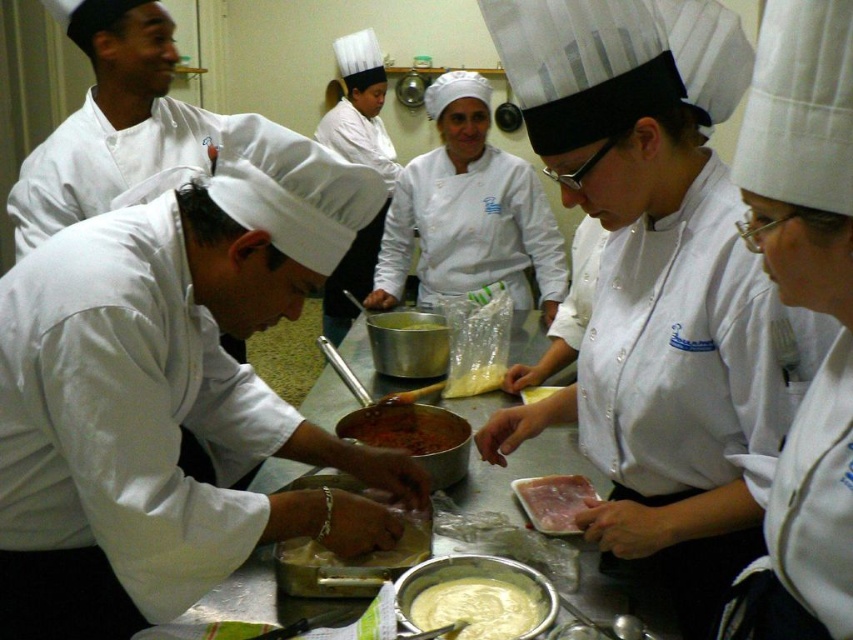
Question: Which of these objects is positioned farthest from the white matte chef coat at left?

Choices:
 (A) thick red sauce at center
 (B) white glossy chef coat at center
 (C) white glossy meat at center

Answer: (C)

Question: Is white creamy sauce at center thinner than white creamy dough at center?

Choices:
 (A) yes
 (B) no

Answer: (A)

Question: Is white matte chef coat at left further to the viewer compared to white glossy meat at center?

Choices:
 (A) no
 (B) yes

Answer: (A)

Question: Which object appears closest to the camera in this image?

Choices:
 (A) white glossy chef coat at center
 (B) thick red sauce at center
 (C) white glossy meat at center

Answer: (A)

Question: Which point is farther to the camera?

Choices:
 (A) yellow creamy cheese at center
 (B) white glossy meat at center

Answer: (A)

Question: Is white creamy sauce at center bigger than white creamy dough at center?

Choices:
 (A) no
 (B) yes

Answer: (A)